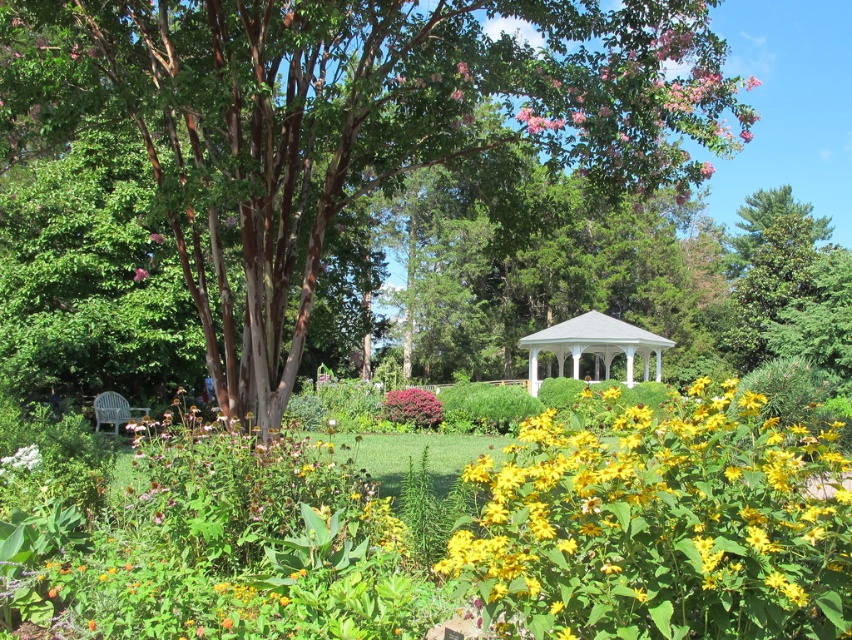
Is point (776, 532) farther from viewer compared to point (390, 412)?

No.

You are a GUI agent. You are given a task and a screenshot of the screen. Output one action in this format:
    pyautogui.click(x=<x>, y=<y>)
    Task: Click on the yellow matte flower at center
    Image resolution: width=852 pixels, height=640 pixels.
    Given the screenshot: What is the action you would take?
    pyautogui.click(x=661, y=524)

Which is below, purple matte bush at center or pink matte flower at center?

purple matte bush at center is below.

Between purple matte bush at center and pink matte flower at center, which one has less height?

Standing shorter between the two is pink matte flower at center.

You are a GUI agent. You are given a task and a screenshot of the screen. Output one action in this format:
    pyautogui.click(x=<x>, y=<y>)
    Task: Click on the purple matte bush at center
    
    Given the screenshot: What is the action you would take?
    pyautogui.click(x=412, y=406)

Who is positioned more to the right, brown textured tree at center or purple matte bush at center?

brown textured tree at center

Does brown textured tree at center have a larger size compared to purple matte bush at center?

Correct, brown textured tree at center is larger in size than purple matte bush at center.

Measure the distance between point (78, 36) and camera.

Point (78, 36) and camera are 8.17 meters apart from each other.

Where is `brown textured tree at center`? The width and height of the screenshot is (852, 640). brown textured tree at center is located at coordinates (350, 124).